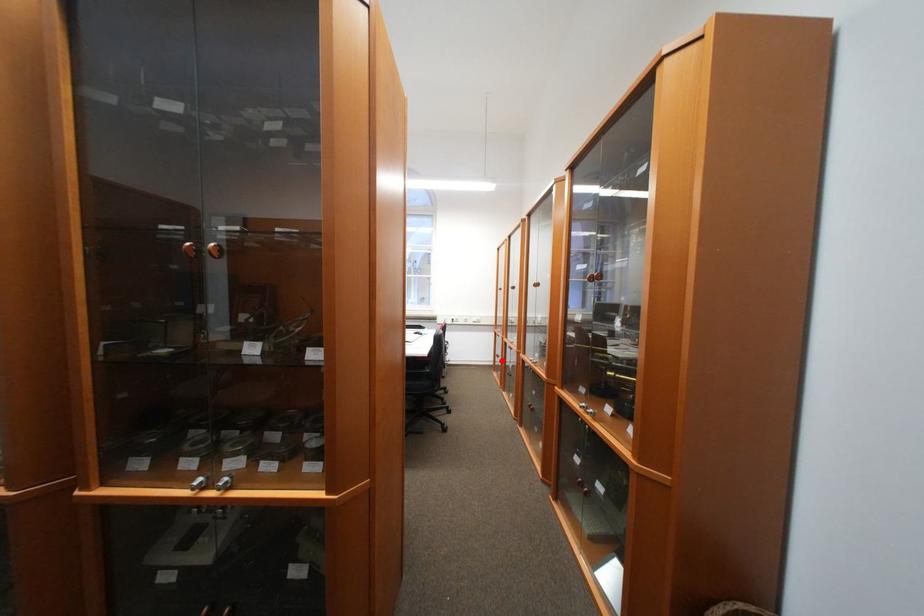
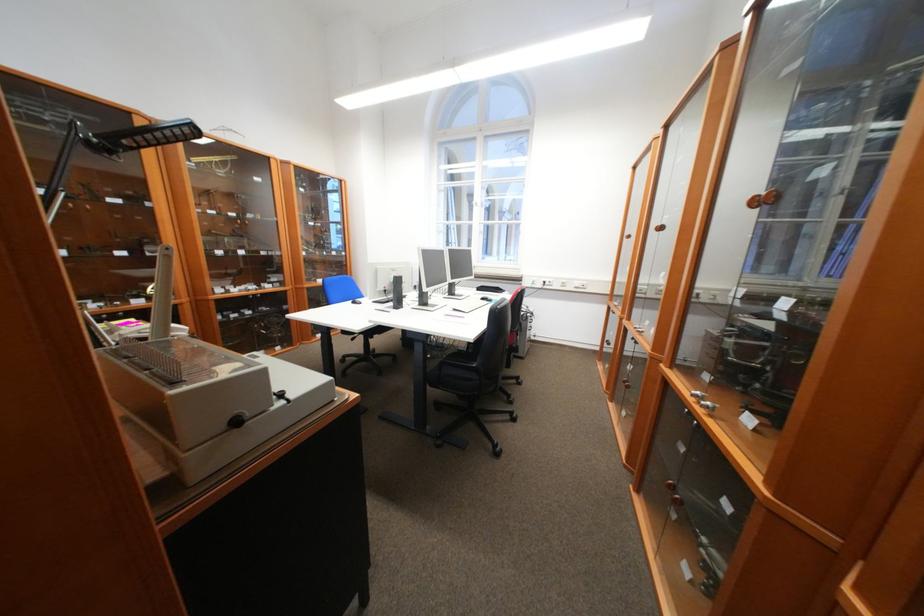
Question: I am providing you with two images of the same scene from different viewpoints. Given a red point in image1, look at the same physical point in image2. Is it:

Choices:
 (A) Closer to the viewpoint
 (B) Farther from the viewpoint

Answer: (A)